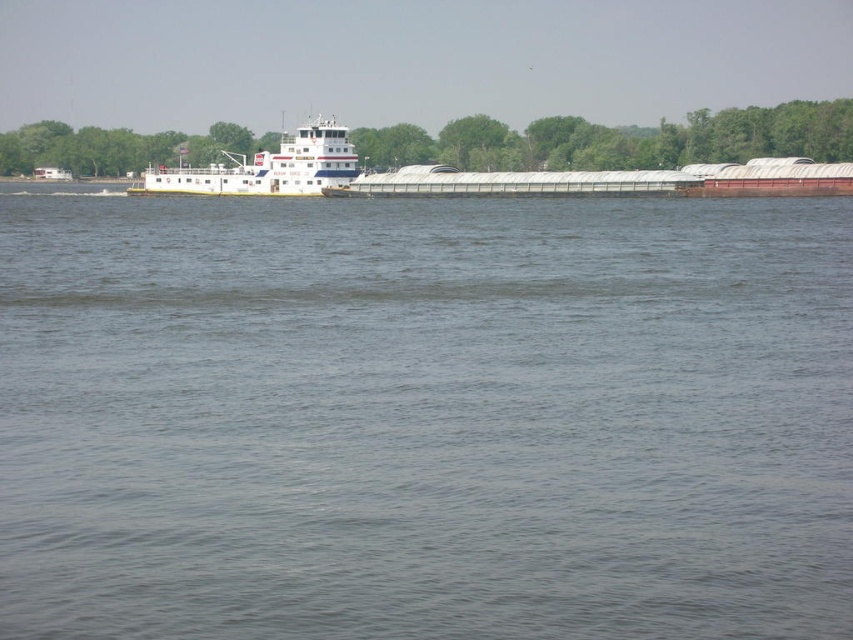
You are a photographer standing on the riverbank. You want to capture a photo where the white glossy barge at center is clearly visible behind the gray matte water at center. Is this possible given their positions?

The gray matte water at center is in front of the white glossy barge at center, so the water will block the view of the barge. Therefore, it is not possible to clearly see the white glossy barge at center behind the gray matte water at center in the photo.

You are standing on the deck of the white and blue tugboat at the front of the barge. You notice a point marked at coordinates [424,417]. What is the object located at this point?

The gray matte water at center is located at point [424,417].